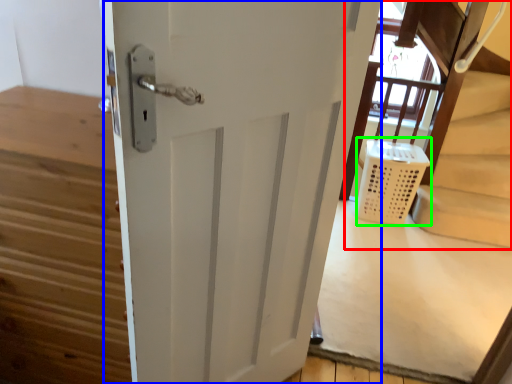
Question: Which object is positioned farthest from bunk bed (highlighted by a red box)? Select from door (highlighted by a blue box) and laundry basket (highlighted by a green box).

Choices:
 (A) door
 (B) laundry basket

Answer: (A)